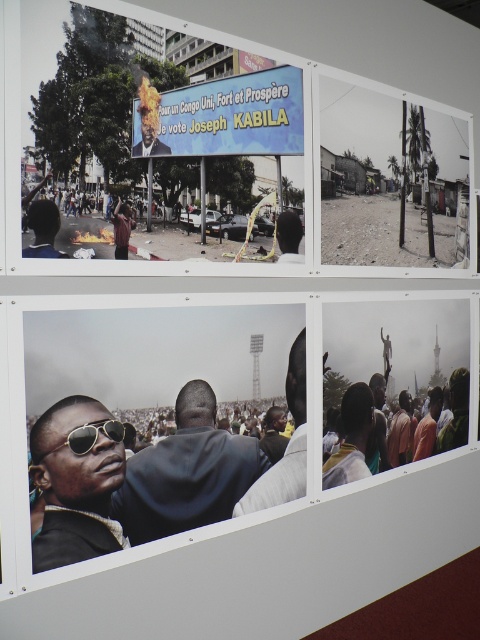
You are a photographer who wants to capture a closeup of the sunglasses at center without the matte plastic billboard at upper center appearing in the frame. Is this possible given their sizes?

The matte plastic billboard at upper center is larger in size than sunglasses at center, so it might be challenging to frame the sunglasses at center without including the billboard, especially if they are positioned close to each other in the scene.

You are standing in front of the four photographs arranged in a grid on the wall. You are holding a 1.8 meter long measuring tape and want to measure the distance between yourself and the matte black sunglasses at center. Can you reach the sunglasses with the measuring tape?

The distance between you and the matte black sunglasses at center is 2.01 meters, which is slightly longer than the 1.8 meter measuring tape. Therefore, you cannot fully reach the sunglasses with the measuring tape.

You are a photographer who wants to capture a closeup of the dark blue suit at center and sunglasses at center in the top left photo. What is the minimum distance your camera lens should be able to focus to capture both objects clearly in the same frame?

The dark blue suit at center is 27.28 centimeters from sunglasses at center. To capture both clearly in the same frame, the camera lens must be able to focus at a distance that accommodates this separation, which is 27.28 centimeters.